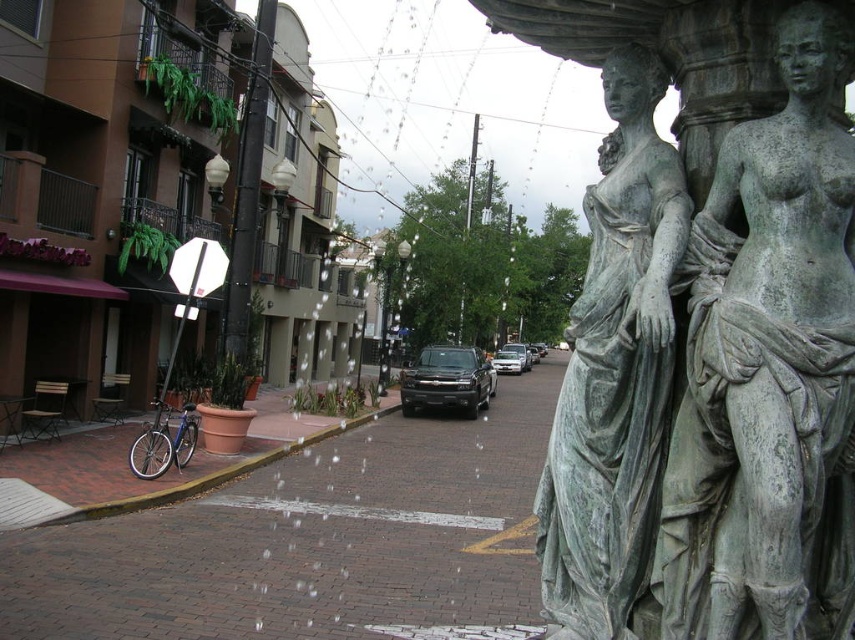
Question: Estimate the real-world distances between objects in this image. Which object is farther from the green patina statue at center?

Choices:
 (A) green patina statue at right
 (B) shiny black suv at center
 (C) silver metallic bicycle at lower left

Answer: (B)

Question: Which point is closer to the camera taking this photo?

Choices:
 (A) (482, 371)
 (B) (597, 305)
 (C) (503, 358)
 (D) (659, 544)

Answer: (D)

Question: Which object is the closest to the silver metallic bicycle at lower left?

Choices:
 (A) satin black suv at center
 (B) shiny black suv at center
 (C) green patina statue at center
 (D) green patina statue at right

Answer: (C)

Question: Does shiny black suv at center have a smaller size compared to silver metallic bicycle at lower left?

Choices:
 (A) yes
 (B) no

Answer: (B)

Question: Is shiny black suv at center bigger than satin black suv at center?

Choices:
 (A) yes
 (B) no

Answer: (A)

Question: Can you confirm if shiny black suv at center is positioned below silver metallic bicycle at lower left?

Choices:
 (A) no
 (B) yes

Answer: (A)